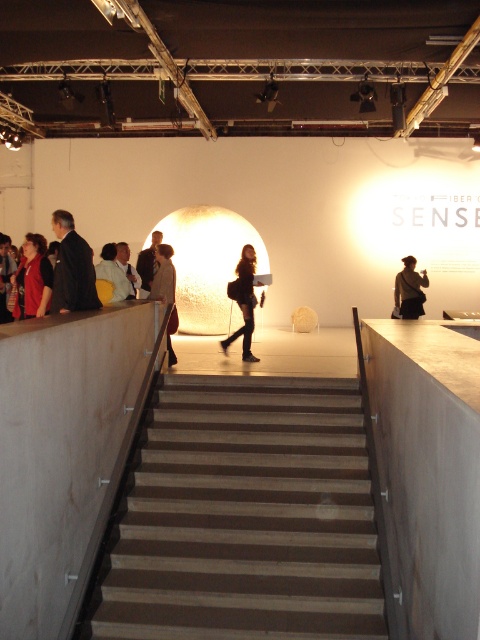
You are an event organizer planning to place a 1.2 meter wide decorative panel between the light beige suit at center and the light brown leather jacket at center. Based on their widths, will there be enough space between them to fit the panel?

The light beige suit at center might be wider than light brown leather jacket at center, so it is uncertain if there is enough space between them to fit the 1.2 meter wide decorative panel. Further measurement is needed to confirm.

You are an event organizer planning to place a 1.2 meter wide banner between the matte red shirt at left and the light beige suit at center. Based on their sizes, will the banner fit comfortably between them?

The matte red shirt at left is wider than the light beige suit at center. Since the banner is 1.2 meters wide, it may not fit comfortably between them if the space between the shirt and suit is narrower than the banner.